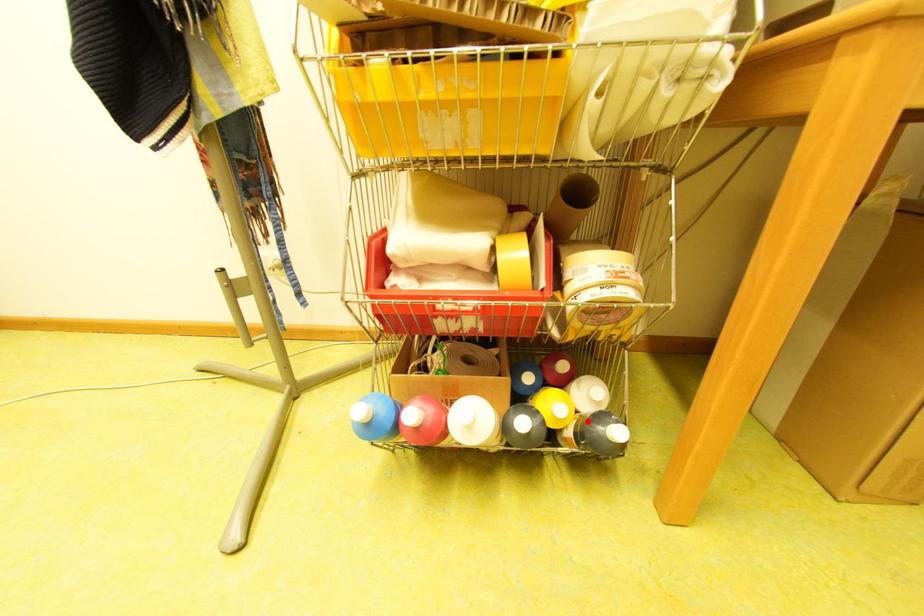
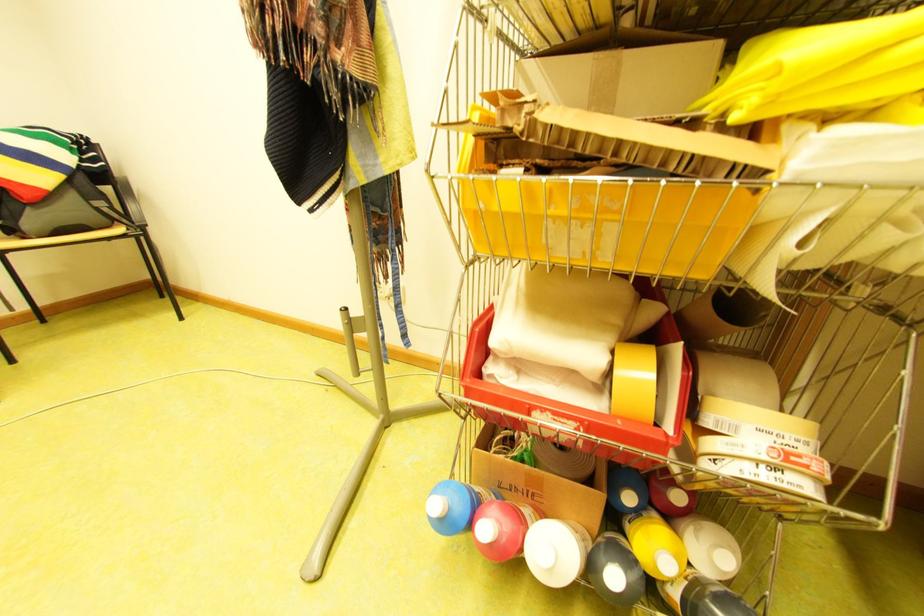
Locate, in the second image, the point that corresponds to the highlighted location in the first image.

(699, 584)